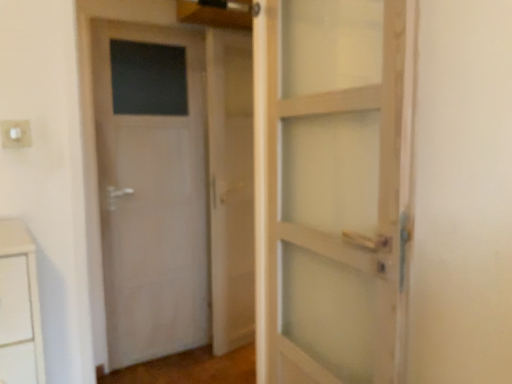
Question: Should I look upward or downward to see white plastic electric outlet at upper left?

Choices:
 (A) down
 (B) up

Answer: (B)

Question: Is white matte door at left further to camera compared to white wooden barn door at center?

Choices:
 (A) no
 (B) yes

Answer: (A)

Question: Is white matte door at left oriented towards white wooden barn door at center?

Choices:
 (A) no
 (B) yes

Answer: (A)

Question: From the image's perspective, is white matte door at left on top of white wooden barn door at center?

Choices:
 (A) no
 (B) yes

Answer: (A)

Question: Is the surface of white matte door at left in direct contact with white wooden barn door at center?

Choices:
 (A) yes
 (B) no

Answer: (B)

Question: Is white matte door at left positioned beyond the bounds of white wooden barn door at center?

Choices:
 (A) yes
 (B) no

Answer: (A)

Question: Can white wooden barn door at center be found inside white matte door at left?

Choices:
 (A) yes
 (B) no

Answer: (B)

Question: From the image's perspective, is white wooden barn door at center under white plastic electric outlet at upper left?

Choices:
 (A) yes
 (B) no

Answer: (A)

Question: Can you see white wooden barn door at center touching white plastic electric outlet at upper left?

Choices:
 (A) no
 (B) yes

Answer: (A)

Question: Is white wooden barn door at center positioned before white plastic electric outlet at upper left?

Choices:
 (A) yes
 (B) no

Answer: (B)

Question: Could you tell me if white wooden barn door at center is facing white plastic electric outlet at upper left?

Choices:
 (A) no
 (B) yes

Answer: (A)

Question: Is white plastic electric outlet at upper left surrounded by white wooden barn door at center?

Choices:
 (A) no
 (B) yes

Answer: (A)

Question: Is white wooden barn door at center shorter than white plastic electric outlet at upper left?

Choices:
 (A) no
 (B) yes

Answer: (A)

Question: Does white plastic electric outlet at upper left lie behind white matte door at left?

Choices:
 (A) yes
 (B) no

Answer: (B)